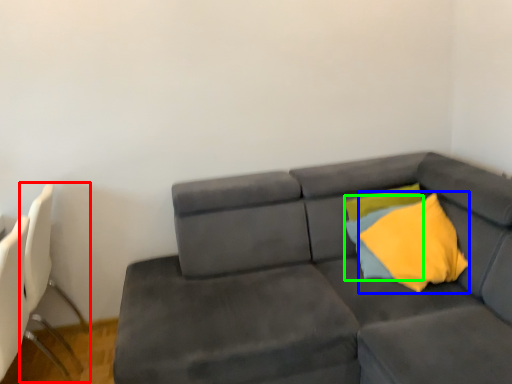
Question: Which object is positioned closest to swivel chair (highlighted by a red box)? Select from throw pillow (highlighted by a blue box) and pillow (highlighted by a green box).

Choices:
 (A) throw pillow
 (B) pillow

Answer: (B)